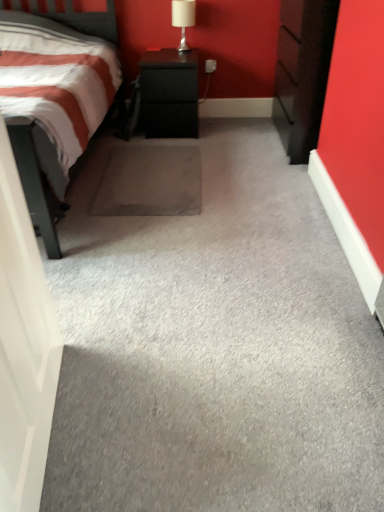
Where is `spots to the right of white glossy door at left`? spots to the right of white glossy door at left is located at coordinates (162, 415).